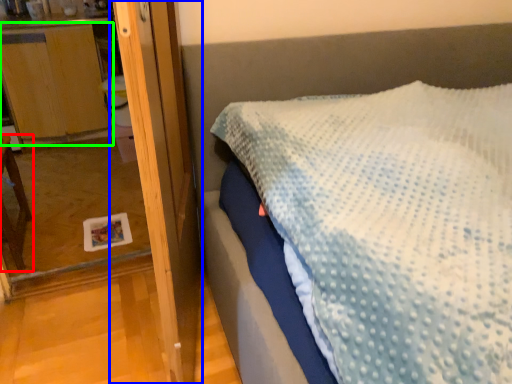
Question: Estimate the real-world distances between objects in this image. Which object is closer to furniture (highlighted by a red box), screen door (highlighted by a blue box) or dresser (highlighted by a green box)?

Choices:
 (A) screen door
 (B) dresser

Answer: (B)